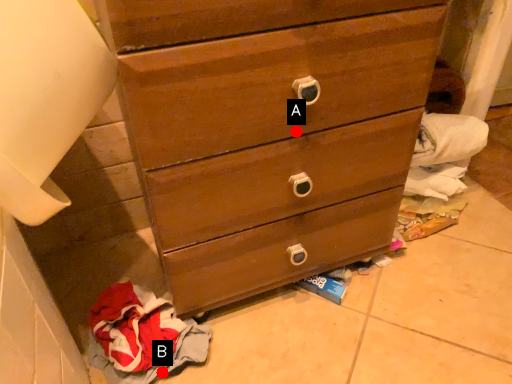
Question: Two points are circled on the image, labeled by A and B beside each circle. Which point is further to the camera?

Choices:
 (A) A is further
 (B) B is further

Answer: (B)